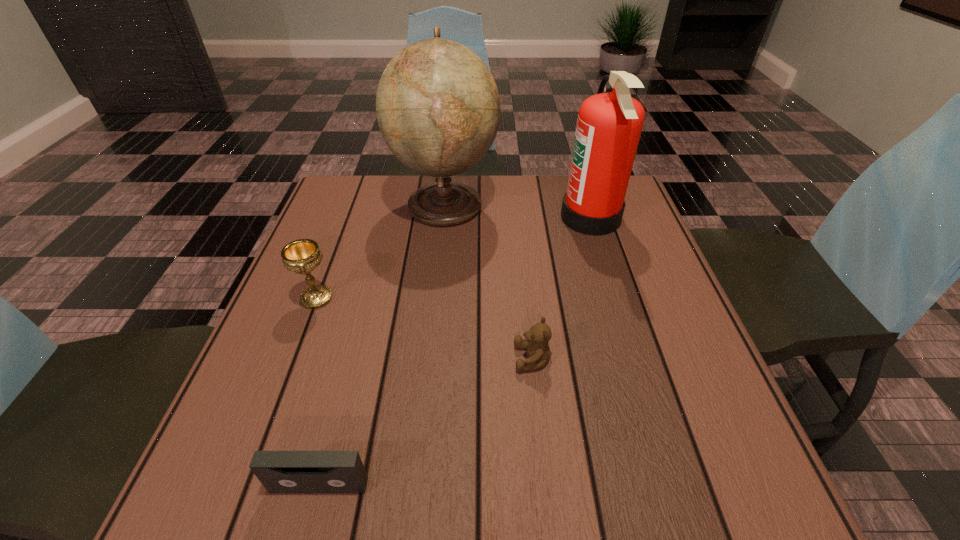
Identify the location of object located at the right edge. tap(609, 125).

Locate an element on the screen. This screenshot has width=960, height=540. object present at the near left corner is located at coordinates (279, 471).

Identify the location of object that is positioned at the far right corner. (609, 125).

At what (x,y) coordinates should I click in order to perform the action: click on vacant point at the far edge. Please return your answer as a coordinate pair (x, y). The width and height of the screenshot is (960, 540). Looking at the image, I should click on (526, 204).

The height and width of the screenshot is (540, 960). In the image, there is a desktop. Identify the location of free space at the near edge. (578, 514).

This screenshot has width=960, height=540. In the image, there is a desktop. In order to click on free space at the left edge in this screenshot , I will do `click(305, 406)`.

This screenshot has width=960, height=540. In the image, there is a desktop. Find the location of `vacant space at the right edge`. vacant space at the right edge is located at coordinates (684, 323).

Where is `free region at the far left corner of the desktop`? The height and width of the screenshot is (540, 960). free region at the far left corner of the desktop is located at coordinates (376, 216).

Find the location of `free area in between the fire extinguisher and the fourth object from left to right`. free area in between the fire extinguisher and the fourth object from left to right is located at coordinates (562, 288).

What are the coordinates of `vacant area that lies between the globe and the second nearest object` in the screenshot? It's located at (489, 281).